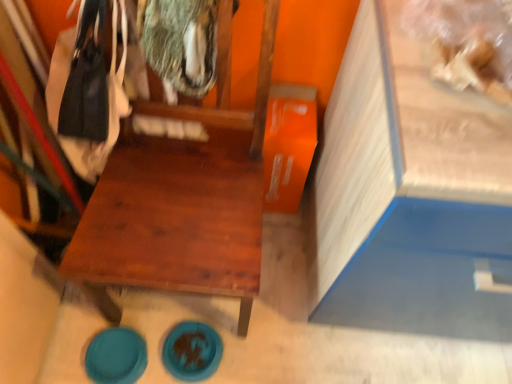
Question: Choose the correct answer: Is wooden chair at center inside teal glossy plate at lower left, which ranks as the 1th plate in left-to-right order, or outside it?

Choices:
 (A) inside
 (B) outside

Answer: (B)

Question: Considering the positions of wooden chair at center and teal glossy plate at lower left, which ranks as the 1th plate in left-to-right order, in the image, is wooden chair at center taller or shorter than teal glossy plate at lower left, which ranks as the 1th plate in left-to-right order,?

Choices:
 (A) tall
 (B) short

Answer: (A)

Question: Which is nearer to the wooden chair at center?

Choices:
 (A) blue matte plate at lower center, which is counted as the 1th plate, starting from the right
 (B) teal glossy plate at lower left, which ranks as the 1th plate in left-to-right order

Answer: (A)

Question: Which object is positioned farthest from the wooden chair at center?

Choices:
 (A) blue matte plate at lower center, which is counted as the 1th plate, starting from the right
 (B) teal glossy plate at lower left, marked as the second plate in a right-to-left arrangement

Answer: (B)